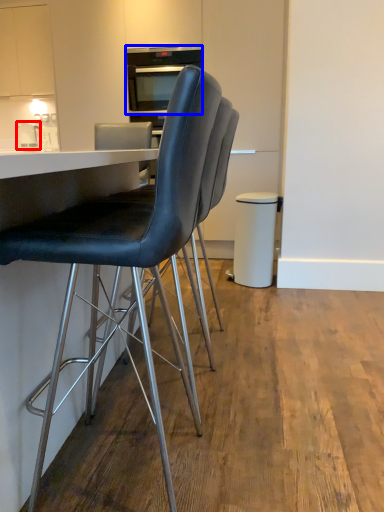
Question: Which object appears farthest to the camera in this image, appliance (highlighted by a red box) or appliance (highlighted by a blue box)?

Choices:
 (A) appliance
 (B) appliance

Answer: (A)